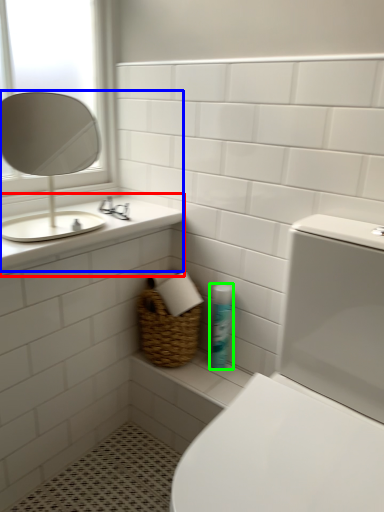
Question: Which object is the farthest from counter top (highlighted by a red box)? Choose among these: sink (highlighted by a blue box) or cleaning product (highlighted by a green box).

Choices:
 (A) sink
 (B) cleaning product

Answer: (A)